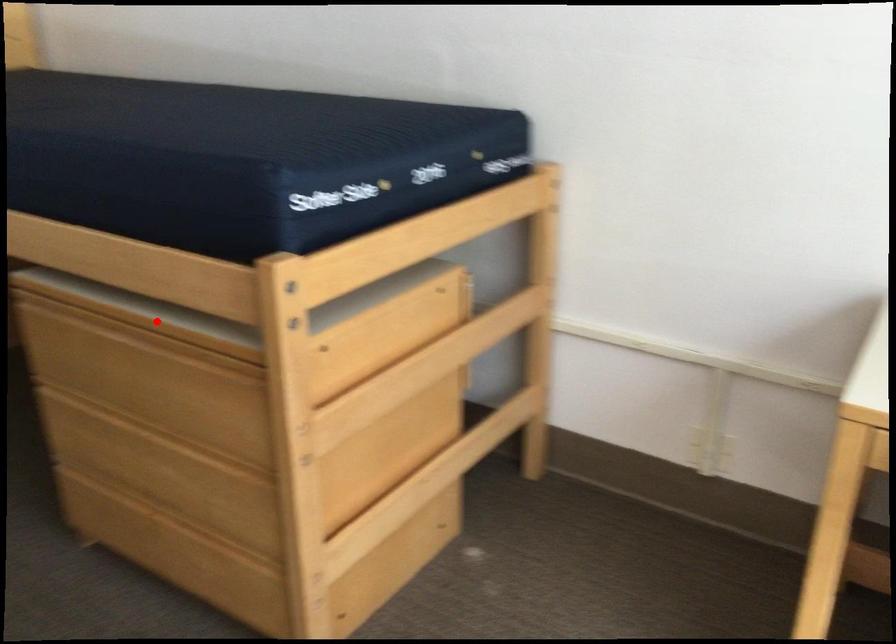
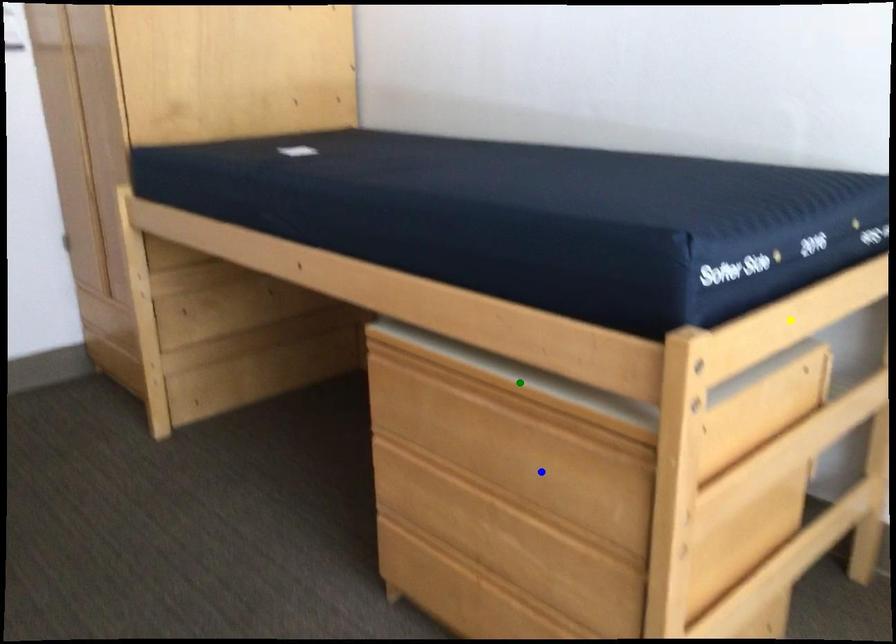
Question: I am providing you with two images of the same scene from different viewpoints. A red point is marked on the first image. You are given multiple points on the second image. Which spot in image 2 lines up with the point in image 1?

Choices:
 (A) yellow point
 (B) green point
 (C) blue point

Answer: (B)